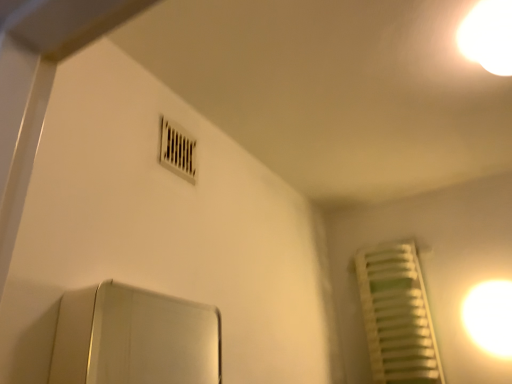
Question: Is white plastic air conditioning at upper center smaller than white matte radiator at right?

Choices:
 (A) yes
 (B) no

Answer: (A)

Question: Does white plastic air conditioning at upper center have a greater width compared to white matte radiator at right?

Choices:
 (A) yes
 (B) no

Answer: (B)

Question: From the image's perspective, is white plastic air conditioning at upper center beneath white matte radiator at right?

Choices:
 (A) no
 (B) yes

Answer: (A)

Question: Can you confirm if white plastic air conditioning at upper center is taller than white matte radiator at right?

Choices:
 (A) no
 (B) yes

Answer: (A)

Question: Is white plastic air conditioning at upper center looking in the opposite direction of white matte radiator at right?

Choices:
 (A) no
 (B) yes

Answer: (A)

Question: From their relative heights in the image, would you say white matte radiator at right is taller or shorter than white plastic air conditioning at upper center?

Choices:
 (A) short
 (B) tall

Answer: (B)

Question: Considering the positions of white matte radiator at right and white plastic air conditioning at upper center in the image, is white matte radiator at right bigger or smaller than white plastic air conditioning at upper center?

Choices:
 (A) small
 (B) big

Answer: (B)

Question: From a real-world perspective, is white matte radiator at right physically located above or below white plastic air conditioning at upper center?

Choices:
 (A) below
 (B) above

Answer: (A)

Question: From the image's perspective, is white matte radiator at right positioned above or below white plastic air conditioning at upper center?

Choices:
 (A) below
 (B) above

Answer: (A)

Question: In the image, is white glossy light at upper right, the 2th light when ordered from top to bottom, positioned in front of or behind white plastic air conditioning at upper center?

Choices:
 (A) behind
 (B) front

Answer: (A)

Question: Is white glossy light at upper right, which is the first light in bottom-to-top order, bigger or smaller than white plastic air conditioning at upper center?

Choices:
 (A) small
 (B) big

Answer: (B)

Question: Looking at their shapes, would you say white glossy light at upper right, arranged as the 1th light when viewed from the back, is wider or thinner than white plastic air conditioning at upper center?

Choices:
 (A) wide
 (B) thin

Answer: (A)

Question: Would you say white glossy light at upper right, which is the first light in bottom-to-top order, is to the left or to the right of white plastic air conditioning at upper center in the picture?

Choices:
 (A) right
 (B) left

Answer: (A)

Question: Is point (377, 334) positioned closer to the camera than point (490, 284)?

Choices:
 (A) farther
 (B) closer

Answer: (A)

Question: Would you say white matte radiator at right is to the left or to the right of white glossy light at upper right, arranged as the 1th light when viewed from the back, in the picture?

Choices:
 (A) right
 (B) left

Answer: (B)